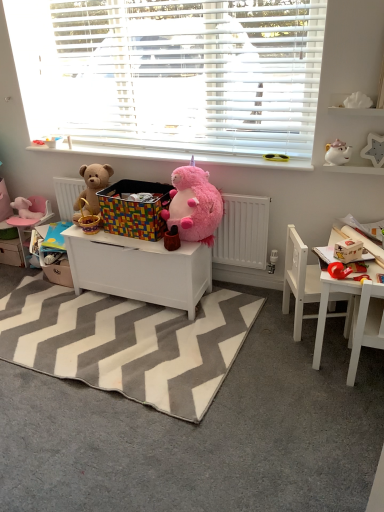
This screenshot has width=384, height=512. What are the coordinates of `free space that is to the left of white plastic chair at right, the 2th chair from the back` in the screenshot? It's located at (313, 377).